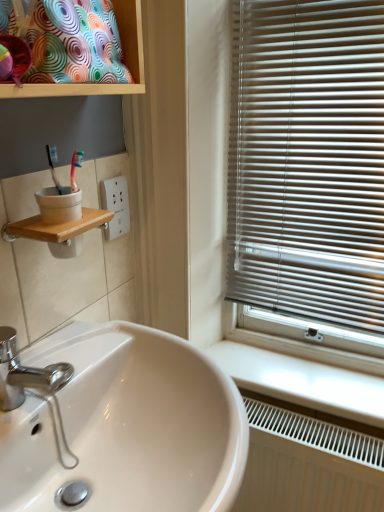
Question: From the image's perspective, is white glossy counter top at lower right beneath white glossy sink at lower left?

Choices:
 (A) yes
 (B) no

Answer: (B)

Question: Can white glossy sink at lower left be found inside white glossy counter top at lower right?

Choices:
 (A) yes
 (B) no

Answer: (B)

Question: Can you see white glossy counter top at lower right touching white glossy sink at lower left?

Choices:
 (A) no
 (B) yes

Answer: (A)

Question: Is white glossy counter top at lower right positioned before white glossy sink at lower left?

Choices:
 (A) yes
 (B) no

Answer: (B)

Question: Can you confirm if white glossy counter top at lower right is shorter than white glossy sink at lower left?

Choices:
 (A) no
 (B) yes

Answer: (B)

Question: Considering the relative positions of white glossy counter top at lower right and white glossy sink at lower left in the image provided, is white glossy counter top at lower right to the left of white glossy sink at lower left from the viewer's perspective?

Choices:
 (A) no
 (B) yes

Answer: (A)

Question: Does white plastic socket at upper center appear on the left side of multicolored fabric cushion at upper left?

Choices:
 (A) no
 (B) yes

Answer: (A)

Question: Is white plastic socket at upper center turned away from multicolored fabric cushion at upper left?

Choices:
 (A) yes
 (B) no

Answer: (B)

Question: From the image's perspective, is white plastic socket at upper center over multicolored fabric cushion at upper left?

Choices:
 (A) yes
 (B) no

Answer: (B)

Question: Is white plastic socket at upper center at the right side of multicolored fabric cushion at upper left?

Choices:
 (A) no
 (B) yes

Answer: (B)

Question: Is white plastic socket at upper center positioned beyond the bounds of multicolored fabric cushion at upper left?

Choices:
 (A) no
 (B) yes

Answer: (B)

Question: From a real-world perspective, is white plastic socket at upper center positioned over multicolored fabric cushion at upper left based on gravity?

Choices:
 (A) yes
 (B) no

Answer: (B)

Question: Can you confirm if white glossy sink at lower left is wider than white glossy counter top at lower right?

Choices:
 (A) yes
 (B) no

Answer: (A)